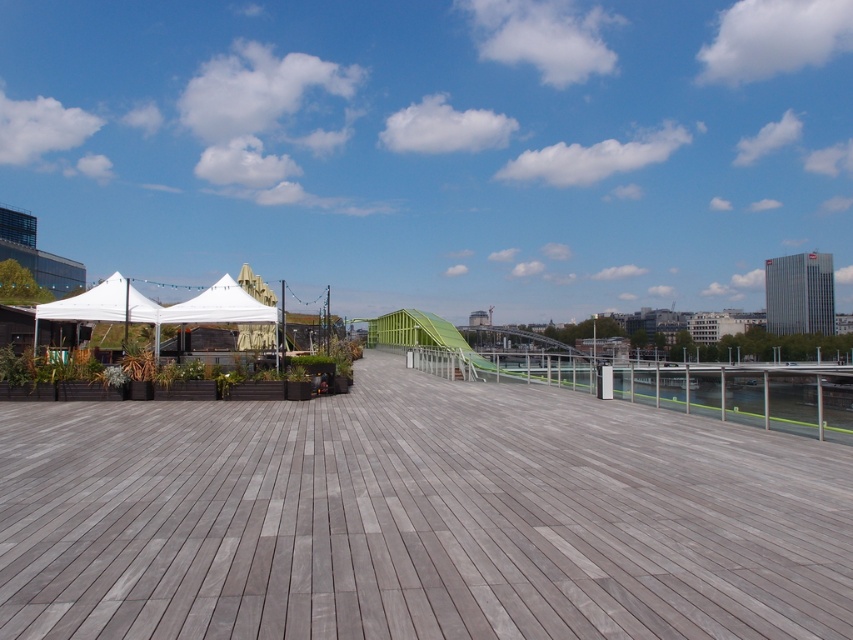
Is gray wood deck at center taller than dark green wooden planter at left?

Yes.

This screenshot has height=640, width=853. Find the location of `gray wood deck at center`. gray wood deck at center is located at coordinates (416, 518).

Image resolution: width=853 pixels, height=640 pixels. In order to click on gray wood deck at center in this screenshot , I will do `click(416, 518)`.

Which is more to the left, dark green wooden planter at left or green plastic slide at center?

dark green wooden planter at left is more to the left.

Is dark green wooden planter at left closer to the viewer compared to green plastic slide at center?

Yes, it is in front of green plastic slide at center.

Which is behind, point (27, 364) or point (431, 312)?

Point (431, 312)

Locate an element on the screen. dark green wooden planter at left is located at coordinates (107, 372).

Does gray wood deck at center have a lesser width compared to green plastic slide at center?

Incorrect, gray wood deck at center's width is not less than green plastic slide at center's.

Which is above, gray wood deck at center or green plastic slide at center?

green plastic slide at center is higher up.

Is point (509, 637) positioned before point (387, 340)?

That is True.

Image resolution: width=853 pixels, height=640 pixels. Find the location of `gray wood deck at center`. gray wood deck at center is located at coordinates (416, 518).